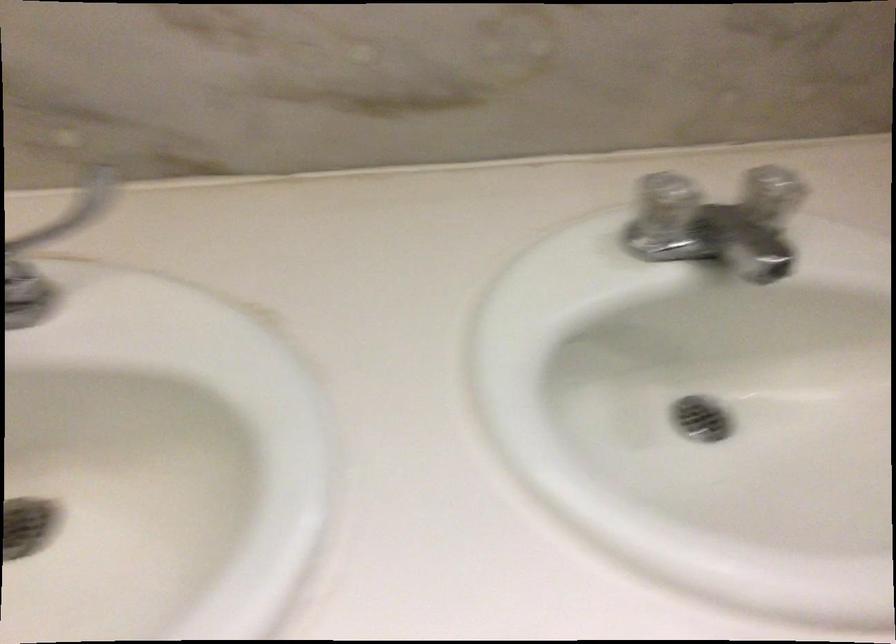
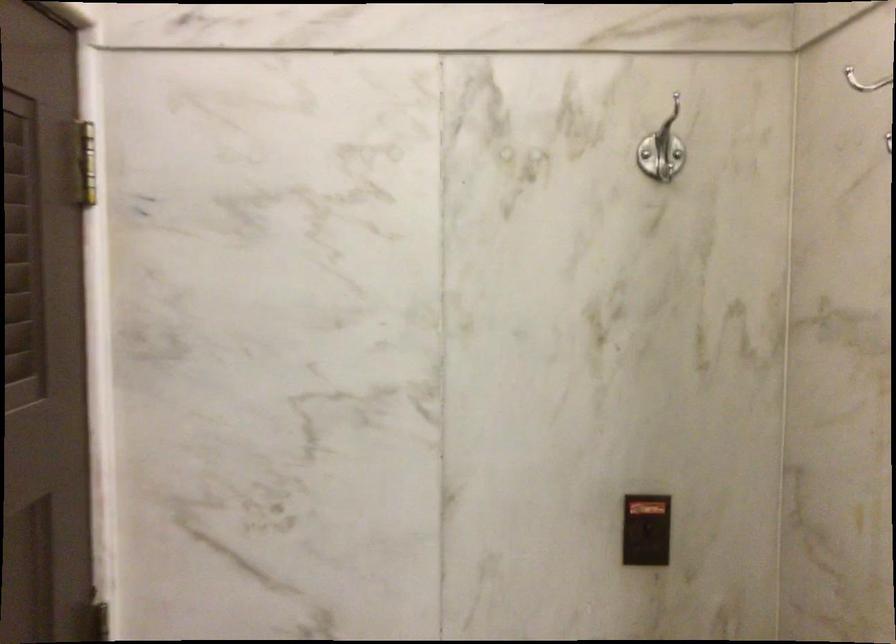
Question: The camera is either moving clockwise (left) or counter-clockwise (right) around the object. The first image is from the beginning of the video and the second image is from the end. Is the camera moving left or right when shooting the video?

Choices:
 (A) Left
 (B) Right

Answer: (B)